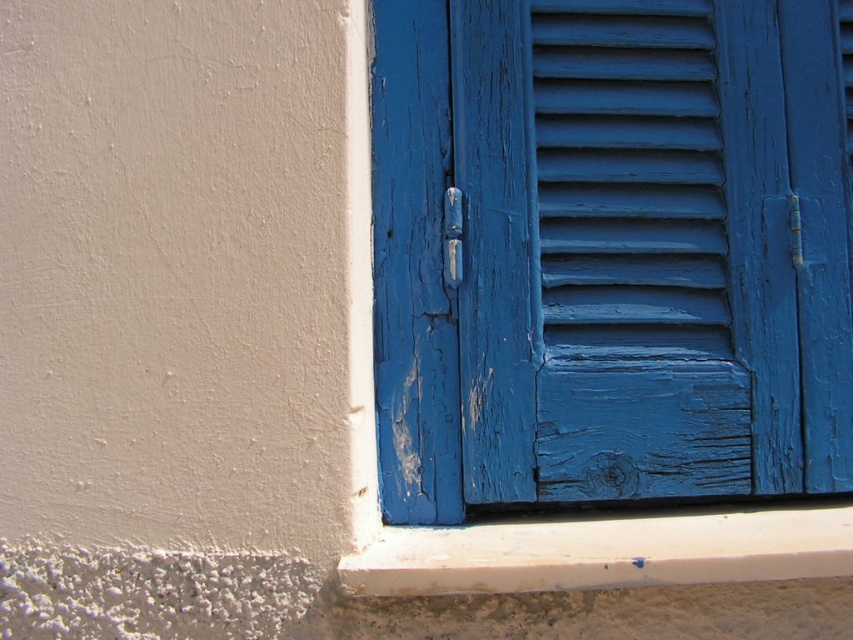
Question: Is blue painted wood shutter at center smaller than blue painted wood shutter at right?

Choices:
 (A) no
 (B) yes

Answer: (B)

Question: Does blue painted wood shutter at center have a smaller size compared to white matte window sill at lower center?

Choices:
 (A) yes
 (B) no

Answer: (A)

Question: Can you confirm if blue painted wood shutter at center is smaller than blue painted wood shutter at right?

Choices:
 (A) yes
 (B) no

Answer: (A)

Question: Which is nearer to the blue painted wood shutter at center?

Choices:
 (A) blue painted wood shutter at right
 (B) white matte window sill at lower center

Answer: (A)

Question: Which of the following is the farthest from the observer?

Choices:
 (A) (660, 333)
 (B) (729, 577)

Answer: (A)

Question: Which point appears closest to the camera in this image?

Choices:
 (A) (425, 556)
 (B) (706, 48)
 (C) (700, 528)

Answer: (A)